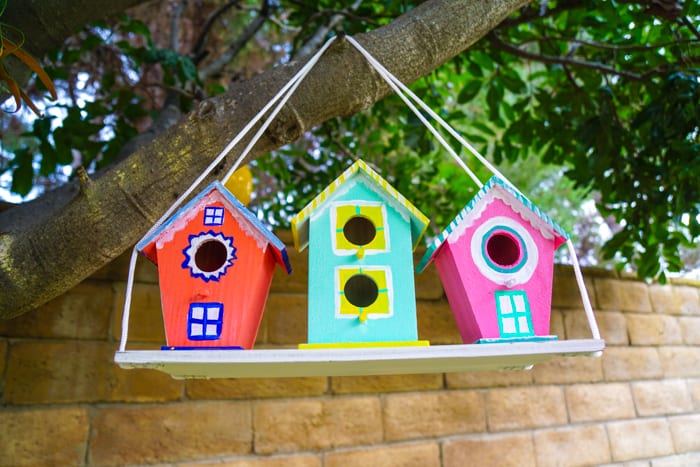
Locate an element on the screen. The height and width of the screenshot is (467, 700). square window is located at coordinates (220, 320), (382, 286), (383, 231), (512, 314).